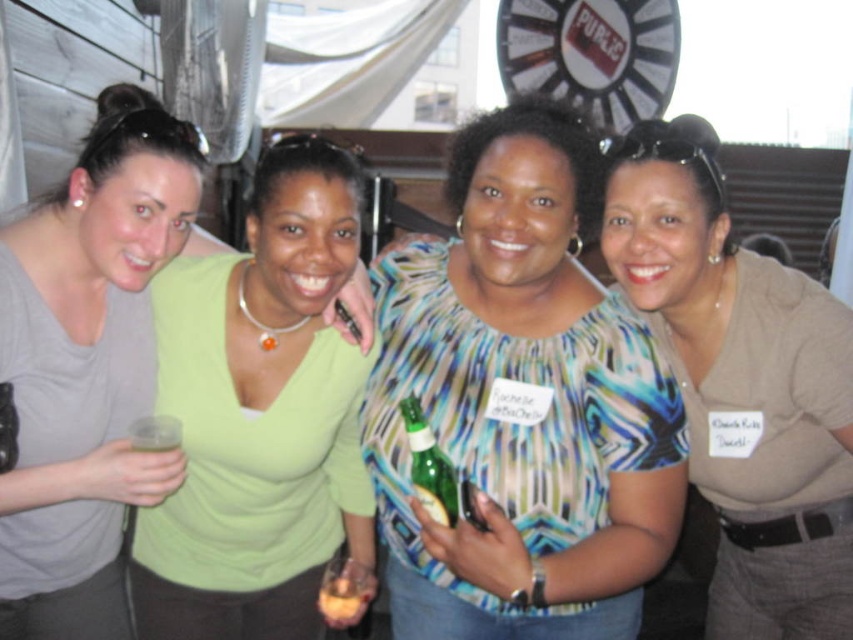
You are at a social event and want to grab the translucent plastic cup at center without moving the matte gray shirt at left. Is it possible based on their positions?

The matte gray shirt at left is above the translucent plastic cup at center, so you can reach the cup below it without moving the shirt.

You are at a networking event and see two items at the center of the image. One is the green matte shirt at center and the other is the green glass bottle at center. Which one is located more to the left?

The green matte shirt at center is positioned on the left side of the green glass bottle at center, so the green matte shirt at center is more to the left.